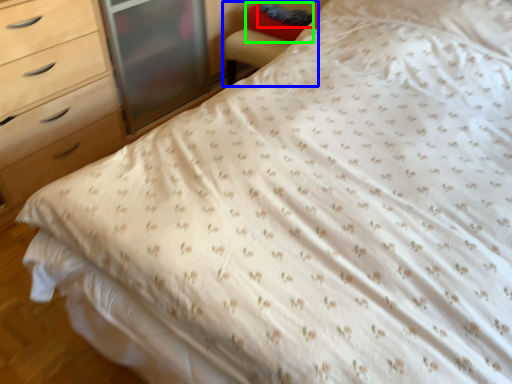
Question: Estimate the real-world distances between objects in this image. Which object is farther from pillow (highlighted by a red box), armchair (highlighted by a blue box) or pillow (highlighted by a green box)?

Choices:
 (A) armchair
 (B) pillow

Answer: (A)